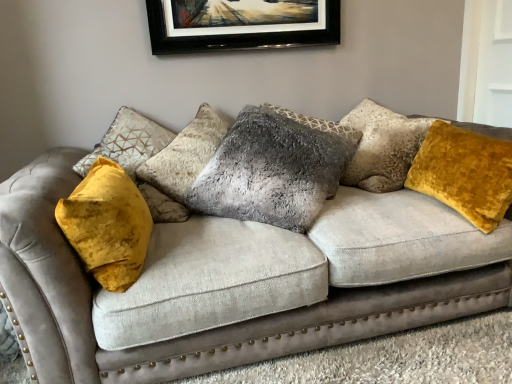
Question: Considering the relative sizes of velvet yellow pillow at right, which ranks as the 2th pillow in left-to-right order, and velvet gray couch at center in the image provided, is velvet yellow pillow at right, which ranks as the 2th pillow in left-to-right order, taller than velvet gray couch at center?

Choices:
 (A) no
 (B) yes

Answer: (A)

Question: Is there a large distance between velvet yellow pillow at right, which ranks as the 2th pillow in left-to-right order, and velvet gray couch at center?

Choices:
 (A) yes
 (B) no

Answer: (B)

Question: Could you tell me if velvet yellow pillow at right, which ranks as the 2th pillow in left-to-right order, is facing velvet gray couch at center?

Choices:
 (A) no
 (B) yes

Answer: (B)

Question: Does velvet yellow pillow at right, placed as the first pillow when sorted from right to left, have a smaller size compared to velvet gray couch at center?

Choices:
 (A) yes
 (B) no

Answer: (A)

Question: Is velvet yellow pillow at right, placed as the first pillow when sorted from right to left, at the right side of velvet gray couch at center?

Choices:
 (A) no
 (B) yes

Answer: (B)

Question: Does point (461, 173) appear closer or farther from the camera than point (336, 135)?

Choices:
 (A) farther
 (B) closer

Answer: (B)

Question: Considering the positions of velvet yellow pillow at right, placed as the first pillow when sorted from right to left, and fuzzy gray pillow at center, arranged as the 1th pillow when viewed from the left, in the image, is velvet yellow pillow at right, placed as the first pillow when sorted from right to left, wider or thinner than fuzzy gray pillow at center, arranged as the 1th pillow when viewed from the left,?

Choices:
 (A) thin
 (B) wide

Answer: (A)

Question: In the image, is velvet yellow pillow at right, placed as the first pillow when sorted from right to left, positioned in front of or behind fuzzy gray pillow at center, arranged as the 1th pillow when viewed from the left?

Choices:
 (A) behind
 (B) front

Answer: (B)

Question: From the image's perspective, is velvet yellow pillow at right, which ranks as the 2th pillow in left-to-right order, positioned above or below fuzzy gray pillow at center, marked as the second pillow in a right-to-left arrangement?

Choices:
 (A) below
 (B) above

Answer: (A)

Question: Looking at their shapes, would you say velvet yellow pillow at right, placed as the first pillow when sorted from right to left, is wider or thinner than velvet gray couch at center?

Choices:
 (A) wide
 (B) thin

Answer: (B)

Question: In terms of height, does velvet yellow pillow at right, placed as the first pillow when sorted from right to left, look taller or shorter compared to velvet gray couch at center?

Choices:
 (A) short
 (B) tall

Answer: (A)

Question: Is point (466, 173) positioned closer to the camera than point (462, 251)?

Choices:
 (A) closer
 (B) farther

Answer: (B)

Question: Is velvet yellow pillow at right, placed as the first pillow when sorted from right to left, spatially inside velvet gray couch at center, or outside of it?

Choices:
 (A) inside
 (B) outside

Answer: (A)

Question: Is velvet gray couch at center inside the boundaries of fuzzy gray pillow at center, marked as the second pillow in a right-to-left arrangement, or outside?

Choices:
 (A) outside
 (B) inside

Answer: (A)

Question: From their relative heights in the image, would you say velvet gray couch at center is taller or shorter than fuzzy gray pillow at center, marked as the second pillow in a right-to-left arrangement?

Choices:
 (A) tall
 (B) short

Answer: (A)